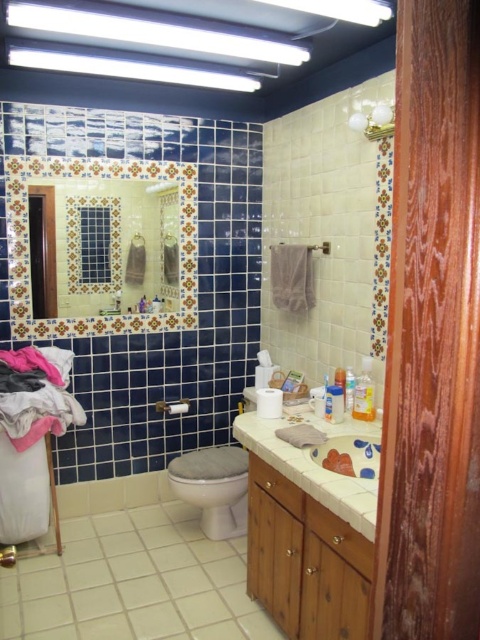
In the bathroom scene, there is a white glossy toilet at center and a white glossy sink at lower center. From the perspective of someone standing in front of the bathroom, which object is positioned to the left?

The white glossy toilet at center is to the left of the white glossy sink at lower center.

You are standing in the bathroom and want to grab the translucent plastic soap at center. Which side of the translucent plastic soap dispenser at center should you reach towards?

The translucent plastic soap at center is to the right of the translucent plastic soap dispenser at center, so you should reach towards the right side of the translucent plastic soap dispenser at center.

You are a bathroom designer who wants to install a new shelf between the wooden cabinet at lower center and the translucent plastic soap dispenser at center. Since you need to know the height difference between them to ensure the shelf is level, can you determine which object is taller?

The wooden cabinet at lower center is much taller than the translucent plastic soap dispenser at center, so the shelf should be installed at the height of the taller wooden cabinet at lower center to stay level.